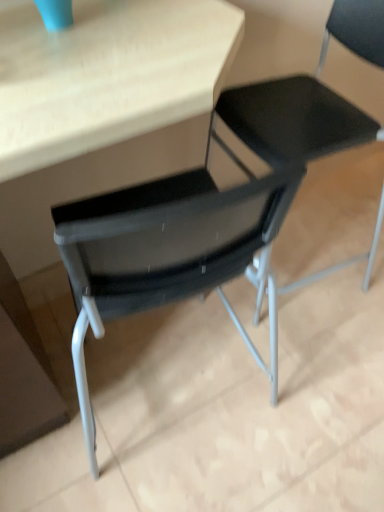
In order to click on black mesh chair at center, the first chair in the left-to-right sequence in this screenshot , I will do `click(309, 98)`.

Identify the location of black mesh chair at center, acting as the 2th chair starting from the left. This screenshot has width=384, height=512. (167, 251).

Can you confirm if matte wood table at center is smaller than black mesh chair at center, placed as the first chair when sorted from right to left?

Actually, matte wood table at center might be larger than black mesh chair at center, placed as the first chair when sorted from right to left.

Would you say matte wood table at center is outside black mesh chair at center, placed as the first chair when sorted from right to left?

That's correct, matte wood table at center is outside of black mesh chair at center, placed as the first chair when sorted from right to left.

Who is more distant, matte wood table at center or black mesh chair at center, acting as the 2th chair starting from the left?

Positioned behind is black mesh chair at center, acting as the 2th chair starting from the left.

Is matte wood table at center positioned far away from black mesh chair at center, placed as the first chair when sorted from right to left?

matte wood table at center is actually quite close to black mesh chair at center, placed as the first chair when sorted from right to left.

Is matte wood table at center taller or shorter than black mesh chair at center, the first chair in the left-to-right sequence?

In the image, matte wood table at center appears to be taller than black mesh chair at center, the first chair in the left-to-right sequence.

Is black mesh chair at center, the second chair in the right-to-left sequence, inside matte wood table at center?

No.

Is matte wood table at center behind black mesh chair at center, the first chair in the left-to-right sequence?

No.

Considering the positions of objects matte wood table at center and black mesh chair at center, the second chair in the right-to-left sequence, in the image provided, who is more to the right, matte wood table at center or black mesh chair at center, the second chair in the right-to-left sequence,?

From the viewer's perspective, black mesh chair at center, the second chair in the right-to-left sequence, appears more on the right side.

Looking at this image, based on their sizes in the image, would you say black mesh chair at center, placed as the first chair when sorted from right to left, is bigger or smaller than matte wood table at center?

Considering their sizes, black mesh chair at center, placed as the first chair when sorted from right to left, takes up less space than matte wood table at center.

Does black mesh chair at center, acting as the 2th chair starting from the left, have a lesser height compared to matte wood table at center?

Correct, black mesh chair at center, acting as the 2th chair starting from the left, is not as tall as matte wood table at center.

Does point (116, 234) come farther from viewer compared to point (94, 186)?

No, (116, 234) is closer to viewer.

The width and height of the screenshot is (384, 512). Find the location of `table that is in front of the black mesh chair at center, acting as the 2th chair starting from the left`. table that is in front of the black mesh chair at center, acting as the 2th chair starting from the left is located at coordinates (90, 144).

Locate an element on the screen. This screenshot has height=512, width=384. chair that appears above the black mesh chair at center, placed as the first chair when sorted from right to left (from a real-world perspective) is located at coordinates (309, 98).

Which is nearer, (349, 145) or (240, 261)?

The point (240, 261) is closer to the camera.

Is black mesh chair at center, the first chair in the left-to-right sequence, positioned far away from black mesh chair at center, acting as the 2th chair starting from the left?

No, there isn't a large distance between black mesh chair at center, the first chair in the left-to-right sequence, and black mesh chair at center, acting as the 2th chair starting from the left.

From the image's perspective, would you say black mesh chair at center, the first chair in the left-to-right sequence, is shown under black mesh chair at center, acting as the 2th chair starting from the left?

Actually, black mesh chair at center, the first chair in the left-to-right sequence, appears above black mesh chair at center, acting as the 2th chair starting from the left, in the image.

Can you see black mesh chair at center, acting as the 2th chair starting from the left, touching black mesh chair at center, the second chair in the right-to-left sequence?

There is a gap between black mesh chair at center, acting as the 2th chair starting from the left, and black mesh chair at center, the second chair in the right-to-left sequence.

You are a GUI agent. You are given a task and a screenshot of the screen. Output one action in this format:
    pyautogui.click(x=<x>, y=<y>)
    Task: Click on the chair positioned vertically above the black mesh chair at center, acting as the 2th chair starting from the left (from a real-world perspective)
    Image resolution: width=384 pixels, height=512 pixels.
    Given the screenshot: What is the action you would take?
    pyautogui.click(x=309, y=98)

Is black mesh chair at center, the second chair in the right-to-left sequence, a part of black mesh chair at center, placed as the first chair when sorted from right to left?

No, black mesh chair at center, the second chair in the right-to-left sequence, is not surrounded by black mesh chair at center, placed as the first chair when sorted from right to left.

Is black mesh chair at center, placed as the first chair when sorted from right to left, smaller than black mesh chair at center, the second chair in the right-to-left sequence?

Correct, black mesh chair at center, placed as the first chair when sorted from right to left, occupies less space than black mesh chair at center, the second chair in the right-to-left sequence.

Is black mesh chair at center, the second chair in the right-to-left sequence, facing towards matte wood table at center?

Yes, black mesh chair at center, the second chair in the right-to-left sequence, is facing matte wood table at center.

Is black mesh chair at center, the first chair in the left-to-right sequence, at the right side of matte wood table at center?

Yes.

From a real-world perspective, between black mesh chair at center, the first chair in the left-to-right sequence, and matte wood table at center, who is vertically higher?

matte wood table at center is physically above.

This screenshot has height=512, width=384. I want to click on the 2nd chair to the right of the matte wood table at center, counting from the anchor's position, so click(167, 251).

Where is `chair lying above the matte wood table at center (from the image's perspective)`? The image size is (384, 512). chair lying above the matte wood table at center (from the image's perspective) is located at coordinates (309, 98).

When comparing their distances from matte wood table at center, does black mesh chair at center, the second chair in the right-to-left sequence, or black mesh chair at center, placed as the first chair when sorted from right to left, seem further?

Based on the image, black mesh chair at center, the second chair in the right-to-left sequence, appears to be further to matte wood table at center.

Based on their spatial positions, is black mesh chair at center, placed as the first chair when sorted from right to left, or matte wood table at center closer to black mesh chair at center, the first chair in the left-to-right sequence?

Among the two, matte wood table at center is located nearer to black mesh chair at center, the first chair in the left-to-right sequence.

When comparing their distances from black mesh chair at center, acting as the 2th chair starting from the left, does matte wood table at center or black mesh chair at center, the first chair in the left-to-right sequence, seem closer?

matte wood table at center lies closer to black mesh chair at center, acting as the 2th chair starting from the left, than the other object.

Based on their spatial positions, is black mesh chair at center, placed as the first chair when sorted from right to left, or black mesh chair at center, the first chair in the left-to-right sequence, closer to matte wood table at center?

black mesh chair at center, placed as the first chair when sorted from right to left, lies closer to matte wood table at center than the other object.

Based on the photo, estimate the real-world distances between objects in this image. Which object is closer to black mesh chair at center, placed as the first chair when sorted from right to left, black mesh chair at center, the first chair in the left-to-right sequence, or matte wood table at center?

Among the two, matte wood table at center is located nearer to black mesh chair at center, placed as the first chair when sorted from right to left.

From the image, which object appears to be farther from black mesh chair at center, the second chair in the right-to-left sequence, matte wood table at center or black mesh chair at center, acting as the 2th chair starting from the left?

Based on the image, black mesh chair at center, acting as the 2th chair starting from the left, appears to be further to black mesh chair at center, the second chair in the right-to-left sequence.

The height and width of the screenshot is (512, 384). Identify the location of table between black mesh chair at center, the second chair in the right-to-left sequence, and black mesh chair at center, placed as the first chair when sorted from right to left, vertically. (90, 144).